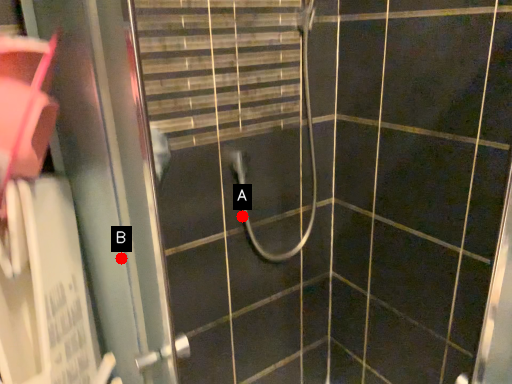
Question: Two points are circled on the image, labeled by A and B beside each circle. Which of the following is the closest to the observer?

Choices:
 (A) A is closer
 (B) B is closer

Answer: (B)